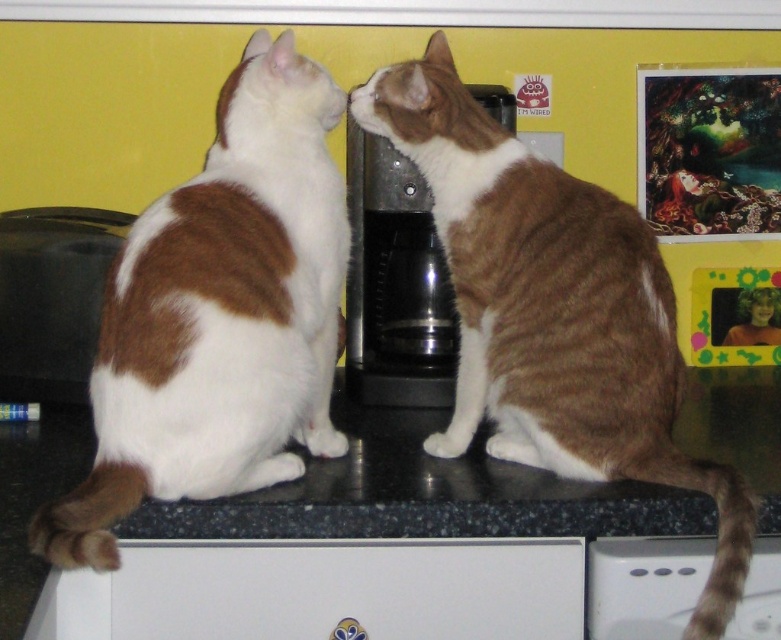
Question: Which is farther from the brown and white fur cat at center?

Choices:
 (A) brown and white fur cat at left
 (B) black granite counter at center
 (C) black plastic coffee machine at center
 (D) blonde hair at upper right

Answer: (D)

Question: Which object is farther from the camera taking this photo?

Choices:
 (A) brown and white fur cat at center
 (B) black granite counter at center
 (C) black plastic coffee machine at center

Answer: (C)

Question: Can you confirm if brown and white fur cat at left is positioned to the right of black granite counter at center?

Choices:
 (A) yes
 (B) no

Answer: (B)

Question: Which point is farther to the camera?

Choices:
 (A) (416, 92)
 (B) (761, 330)

Answer: (B)

Question: Does brown and white fur cat at center have a lesser width compared to black plastic coffee machine at center?

Choices:
 (A) no
 (B) yes

Answer: (A)

Question: Does brown and white fur cat at left appear under black plastic coffee machine at center?

Choices:
 (A) no
 (B) yes

Answer: (B)